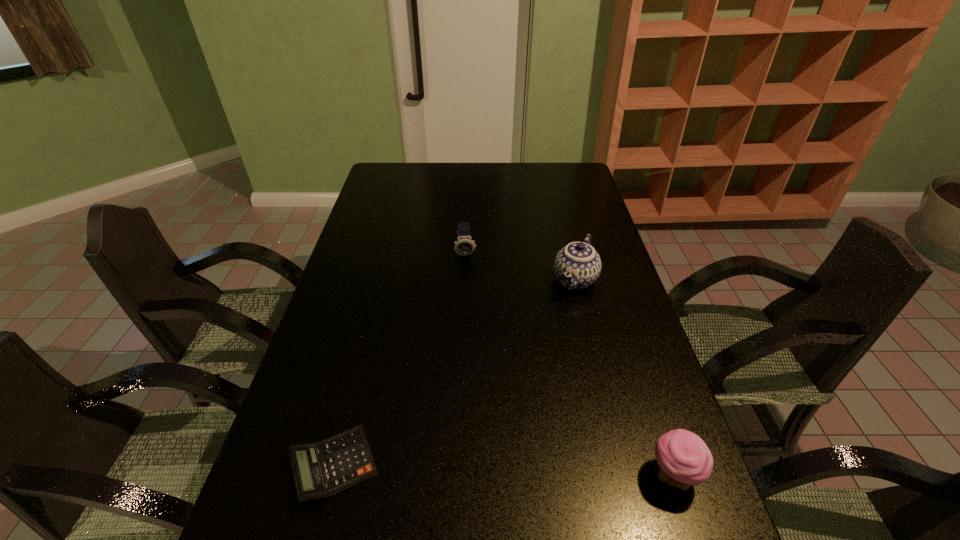
What are the coordinates of `vacant space in between the calculator and the watch` in the screenshot? It's located at (400, 360).

Where is `empty location between the second object from left to right and the tallest object`? This screenshot has height=540, width=960. empty location between the second object from left to right and the tallest object is located at coordinates (520, 267).

This screenshot has width=960, height=540. I want to click on free space between the second object from left to right and the tallest object, so click(520, 267).

I want to click on vacant space that's between the tallest object and the calculator, so click(x=454, y=373).

Identify the location of free spot between the cupcake and the calculator. tap(503, 470).

Locate which object ranks third in proximity to the chinaware. Please provide its 2D coordinates. Your answer should be formatted as a tuple, i.e. [(x, y)], where the tuple contains the x and y coordinates of a point satisfying the conditions above.

[(320, 470)]

Where is `object that is the second closest one to the shortest object`? The width and height of the screenshot is (960, 540). object that is the second closest one to the shortest object is located at coordinates (577, 266).

In order to click on free space in the image that satisfies the following two spatial constraints: 1. on the front side of the tallest object; 2. on the left side of the cupcake in this screenshot , I will do `click(623, 475)`.

In order to click on vacant space that satisfies the following two spatial constraints: 1. on the front side of the second object from left to right; 2. on the right side of the cupcake in this screenshot , I will do `click(457, 475)`.

In order to click on free space that satisfies the following two spatial constraints: 1. on the front side of the cupcake; 2. on the right side of the chinaware in this screenshot , I will do `click(623, 475)`.